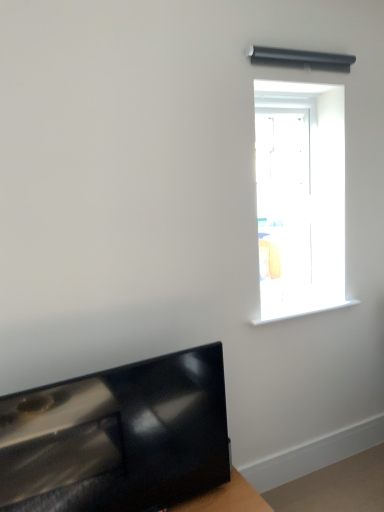
Question: Is white plastic window sill at upper right closer to the viewer compared to wooden table at lower right?

Choices:
 (A) no
 (B) yes

Answer: (A)

Question: Is white plastic window sill at upper right located outside wooden table at lower right?

Choices:
 (A) no
 (B) yes

Answer: (B)

Question: Considering the relative sizes of white plastic window sill at upper right and wooden table at lower right in the image provided, is white plastic window sill at upper right thinner than wooden table at lower right?

Choices:
 (A) yes
 (B) no

Answer: (A)

Question: Is white plastic window sill at upper right not near wooden table at lower right?

Choices:
 (A) yes
 (B) no

Answer: (B)

Question: Can you confirm if white plastic window sill at upper right is smaller than wooden table at lower right?

Choices:
 (A) yes
 (B) no

Answer: (A)

Question: Does white plastic window sill at upper right have a greater width compared to wooden table at lower right?

Choices:
 (A) yes
 (B) no

Answer: (B)

Question: Is the position of glossy black tv at lower left more distant than that of white plastic window sill at upper right?

Choices:
 (A) yes
 (B) no

Answer: (B)

Question: Is glossy black tv at lower left far away from white plastic window sill at upper right?

Choices:
 (A) yes
 (B) no

Answer: (B)

Question: Considering the relative sizes of glossy black tv at lower left and white plastic window sill at upper right in the image provided, is glossy black tv at lower left wider than white plastic window sill at upper right?

Choices:
 (A) no
 (B) yes

Answer: (A)

Question: Is glossy black tv at lower left oriented away from white plastic window sill at upper right?

Choices:
 (A) yes
 (B) no

Answer: (B)

Question: From a real-world perspective, is glossy black tv at lower left beneath white plastic window sill at upper right?

Choices:
 (A) no
 (B) yes

Answer: (B)

Question: Does glossy black tv at lower left have a lesser width compared to white plastic window sill at upper right?

Choices:
 (A) yes
 (B) no

Answer: (A)

Question: Does white plastic window sill at upper right have a smaller size compared to glossy black tv at lower left?

Choices:
 (A) yes
 (B) no

Answer: (A)